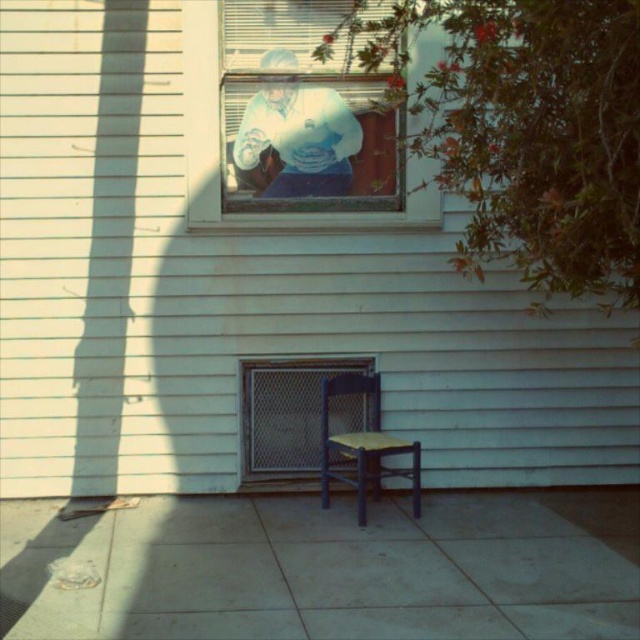
Question: Which point is closer to the camera?

Choices:
 (A) white cotton shirt at upper center
 (B) clear glass window at upper center
 (C) metal mesh door at lower center
 (D) wooden chair at center

Answer: (D)

Question: Can you confirm if clear glass window at upper center is positioned above white cotton shirt at upper center?

Choices:
 (A) yes
 (B) no

Answer: (B)

Question: Estimate the real-world distances between objects in this image. Which object is closer to the metal mesh door at lower center?

Choices:
 (A) wooden chair at center
 (B) clear glass window at upper center

Answer: (A)

Question: Can you confirm if clear glass window at upper center is thinner than white cotton shirt at upper center?

Choices:
 (A) no
 (B) yes

Answer: (A)

Question: Among these points, which one is nearest to the camera?

Choices:
 (A) (289, 176)
 (B) (364, 388)
 (C) (305, 449)

Answer: (B)

Question: Where is white cotton shirt at upper center located in relation to wooden chair at center in the image?

Choices:
 (A) below
 (B) above

Answer: (B)